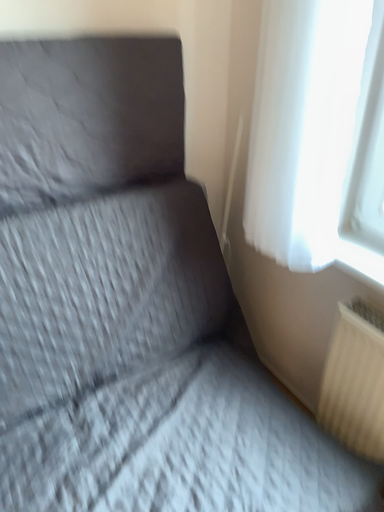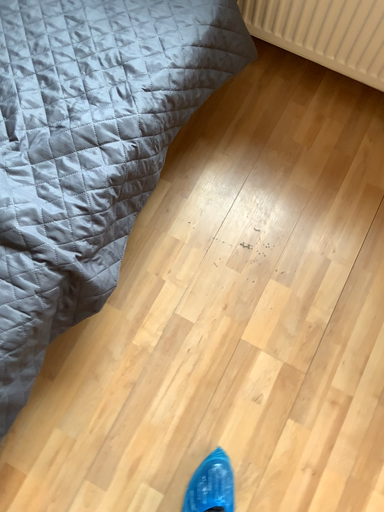
Question: Which way did the camera rotate in the video?

Choices:
 (A) rotated right
 (B) rotated left

Answer: (A)